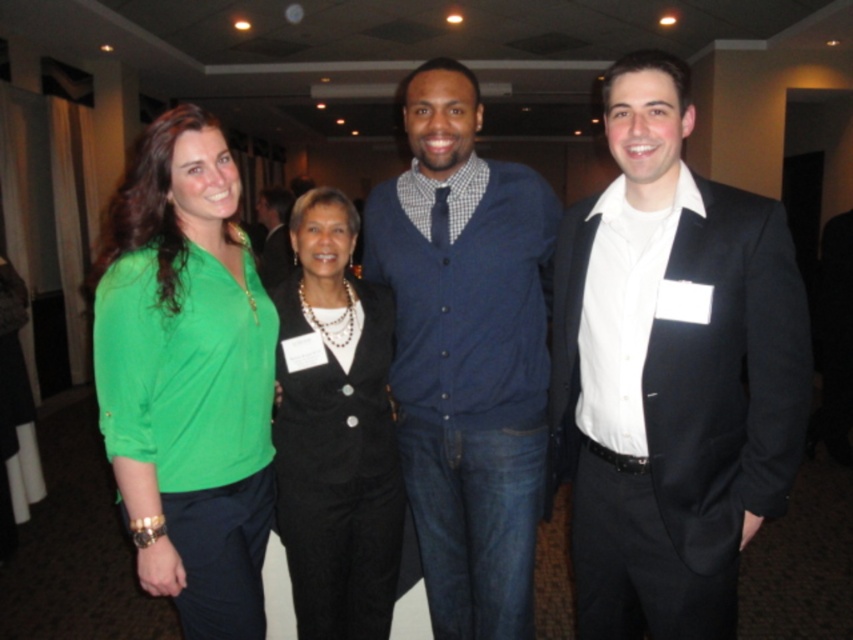
Between point (726, 614) and point (229, 358), which one is positioned behind?

The point (726, 614) is behind.

Which is above, black satin suit at right or green fabric blouse at left?

black satin suit at right is higher up.

At what (x,y) coordinates should I click in order to perform the action: click on black satin suit at right. Please return your answer as a coordinate pair (x, y). The height and width of the screenshot is (640, 853). Looking at the image, I should click on (670, 372).

Is the position of black textured suit at center less distant than that of matte black blazer at center?

That is True.

Between black textured suit at center and matte black blazer at center, which one is positioned lower?

black textured suit at center is lower down.

Does point (376, 499) lie behind point (283, 252)?

No, (376, 499) is closer to viewer.

You are a GUI agent. You are given a task and a screenshot of the screen. Output one action in this format:
    pyautogui.click(x=<x>, y=<y>)
    Task: Click on the black textured suit at center
    This screenshot has width=853, height=640.
    Given the screenshot: What is the action you would take?
    pyautogui.click(x=335, y=433)

Does matte blue sweater at center lie in front of black textured suit at center?

Yes, it is in front of black textured suit at center.

Between matte blue sweater at center and black textured suit at center, which one appears on the right side from the viewer's perspective?

From the viewer's perspective, matte blue sweater at center appears more on the right side.

This screenshot has width=853, height=640. What are the coordinates of `matte blue sweater at center` in the screenshot? It's located at pyautogui.click(x=466, y=353).

Locate an element on the screen. The width and height of the screenshot is (853, 640). matte blue sweater at center is located at coordinates (466, 353).